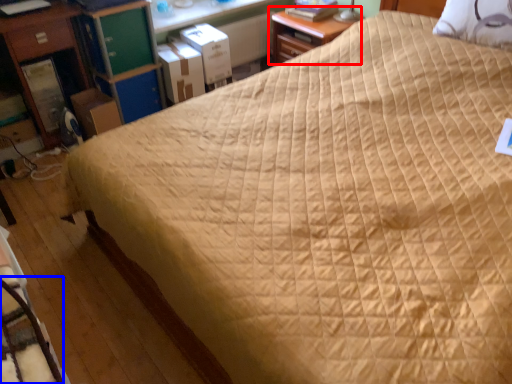
Question: Among these objects, which one is nearest to the camera, nightstand (highlighted by a red box) or rocking chair (highlighted by a blue box)?

Choices:
 (A) nightstand
 (B) rocking chair

Answer: (B)